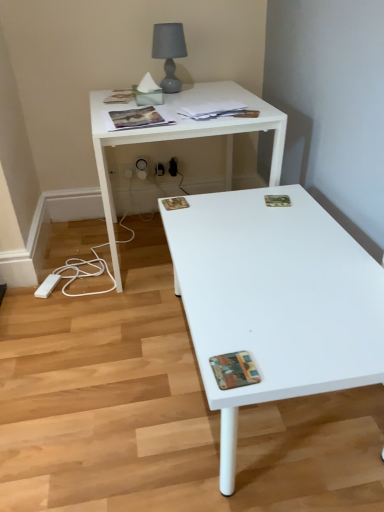
Where is `free space above white matte coffee table at lower right (from a real-world perspective)`? free space above white matte coffee table at lower right (from a real-world perspective) is located at coordinates (122, 341).